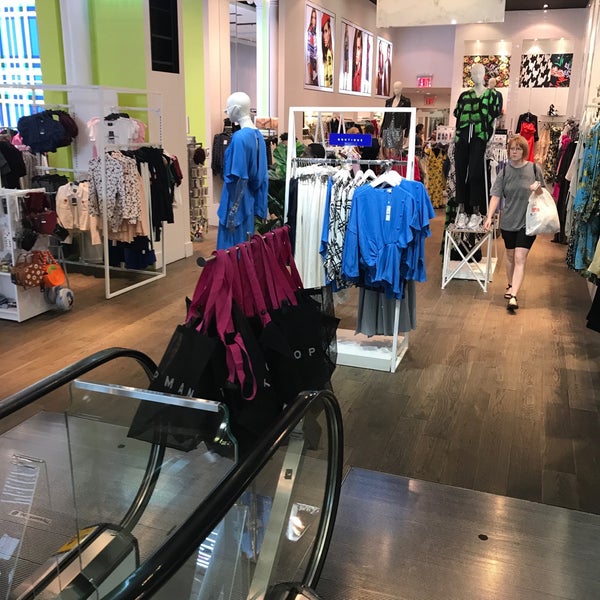
Locate an element on the screen. This screenshot has width=600, height=600. wood floor is located at coordinates tap(491, 431).